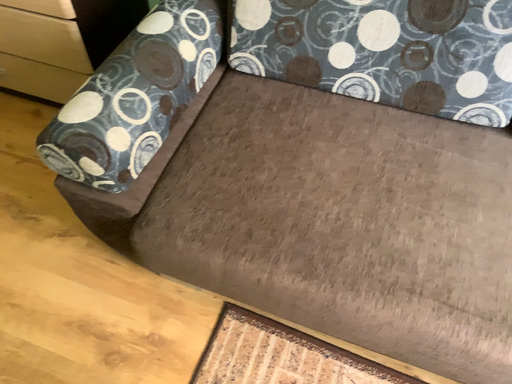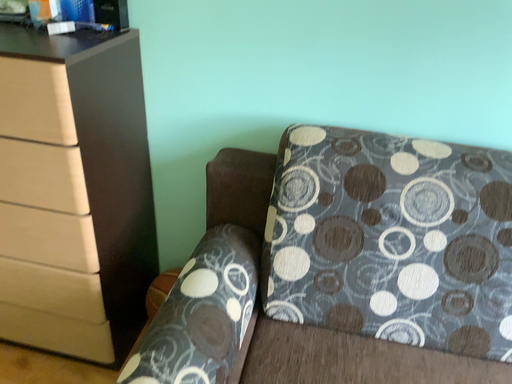
Question: Which way did the camera rotate in the video?

Choices:
 (A) rotated upward
 (B) rotated downward

Answer: (A)